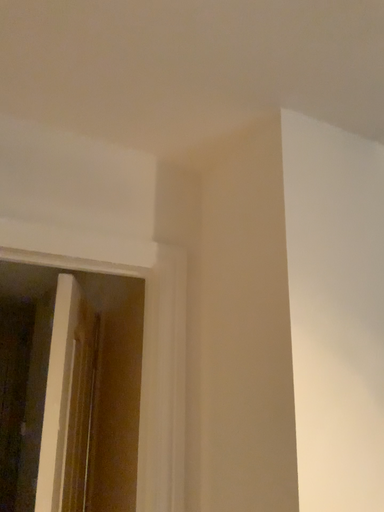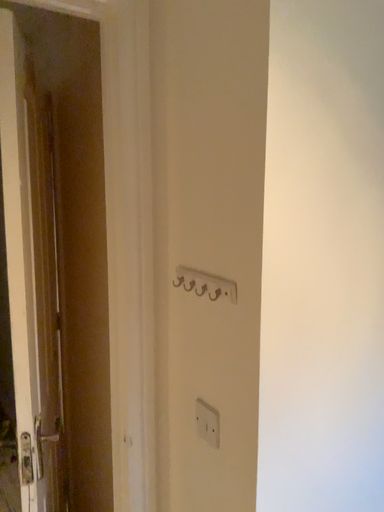
Question: How did the camera likely rotate when shooting the video?

Choices:
 (A) rotated upward
 (B) rotated downward

Answer: (B)